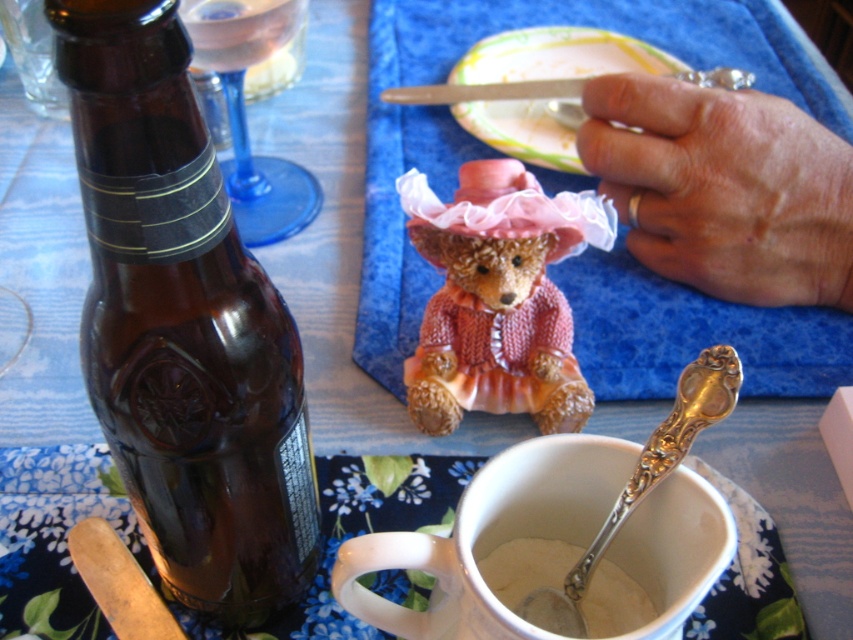
Question: Considering the relative positions of pink fabric figurine at center and white creamy substance at cup center in the image provided, where is pink fabric figurine at center located with respect to white creamy substance at cup center?

Choices:
 (A) left
 (B) right

Answer: (B)

Question: Which point appears farthest from the camera in this image?

Choices:
 (A) (96, 170)
 (B) (653, 536)

Answer: (B)

Question: Estimate the real-world distances between objects in this image. Which object is closer to the brown glass bottle at left?

Choices:
 (A) white ceramic mug at lower center
 (B) smooth skin hand at upper right

Answer: (A)

Question: Is smooth skin hand at upper right bigger than white ceramic mug at lower center?

Choices:
 (A) no
 (B) yes

Answer: (B)

Question: Can you confirm if brown glass bottle at left is positioned to the left of white creamy substance at cup center?

Choices:
 (A) no
 (B) yes

Answer: (B)

Question: Which object is the closest to the white ceramic mug at lower center?

Choices:
 (A) pink fabric figurine at center
 (B) white creamy substance at cup center

Answer: (B)